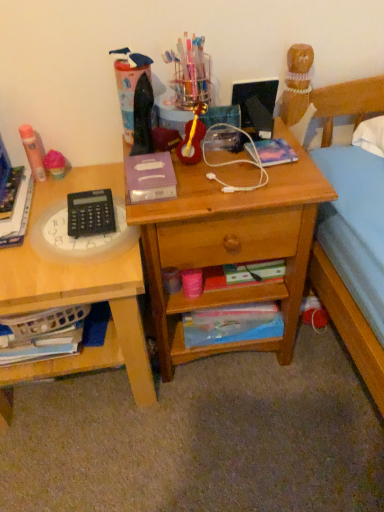
Identify the location of vacant space in front of shiny black laptop at upper center. The width and height of the screenshot is (384, 512). (256, 175).